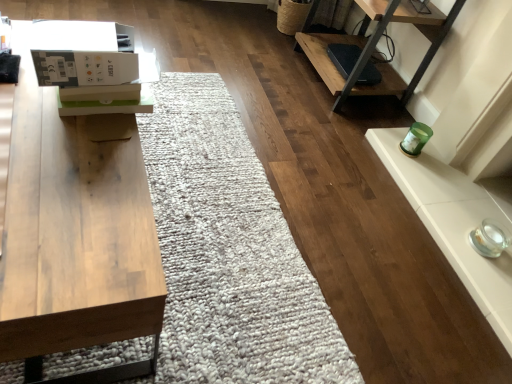
Question: Is white cardboard box at upper left taller than wooden table at left?

Choices:
 (A) yes
 (B) no

Answer: (B)

Question: Considering the relative sizes of white cardboard box at upper left and wooden table at left in the image provided, is white cardboard box at upper left thinner than wooden table at left?

Choices:
 (A) yes
 (B) no

Answer: (A)

Question: Is white cardboard box at upper left smaller than wooden table at left?

Choices:
 (A) no
 (B) yes

Answer: (B)

Question: Is white cardboard box at upper left to the right of wooden table at left from the viewer's perspective?

Choices:
 (A) yes
 (B) no

Answer: (A)

Question: Is wooden table at left a part of white cardboard box at upper left?

Choices:
 (A) no
 (B) yes

Answer: (A)

Question: Is white cardboard box at upper left not within wooden table at left?

Choices:
 (A) no
 (B) yes

Answer: (B)

Question: Does wooden table at left have a greater width compared to white cardboard box at upper left?

Choices:
 (A) no
 (B) yes

Answer: (B)

Question: Considering the relative positions of wooden table at left and white cardboard box at upper left in the image provided, is wooden table at left to the right of white cardboard box at upper left from the viewer's perspective?

Choices:
 (A) yes
 (B) no

Answer: (B)

Question: Does wooden table at left have a smaller size compared to white cardboard box at upper left?

Choices:
 (A) no
 (B) yes

Answer: (A)

Question: Is white cardboard box at upper left completely or partially inside wooden table at left?

Choices:
 (A) yes
 (B) no

Answer: (B)

Question: Are wooden table at left and white cardboard box at upper left making contact?

Choices:
 (A) no
 (B) yes

Answer: (A)

Question: From a real-world perspective, is wooden table at left under white cardboard box at upper left?

Choices:
 (A) no
 (B) yes

Answer: (B)

Question: Is white cardboard box at upper left in front of or behind wooden table at left in the image?

Choices:
 (A) behind
 (B) front

Answer: (A)